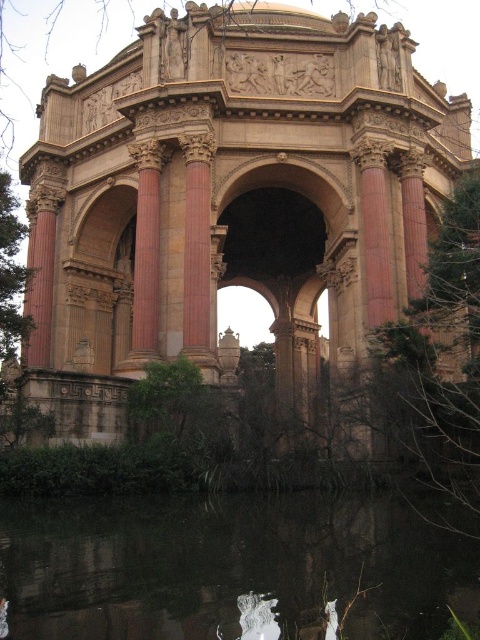
In the scene shown: You are standing at point A located at coordinates 0.200, 0.500 in the image. You want to walk directly towards the beige stone palace at center. Which direction should you move relative to your current position?

You should move to the right relative to your current position at point A because the beige stone palace at center is located at coordinates (235, 192), which is to the right of your current position at (240, 128).

You are standing in front of the beige stone palace at center and want to see your reflection in the black reflective water at bottom. In which direction should you move to reach the water?

The beige stone palace at center is positioned on the right side of black reflective water at bottom, so you should move to the left to reach the water and see your reflection.

You are standing in front of the Palace of Fine Arts and want to take a photo that includes both the beige stone palace at center and the black reflective water at bottom. Which object should you focus on first to ensure both are in frame?

You should focus on the beige stone palace at center first because it is bigger than the black reflective water at bottom, so it requires more space in the frame.